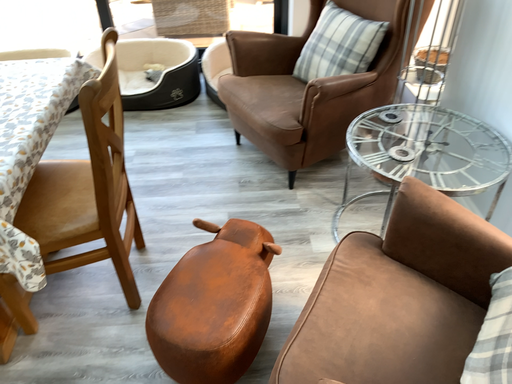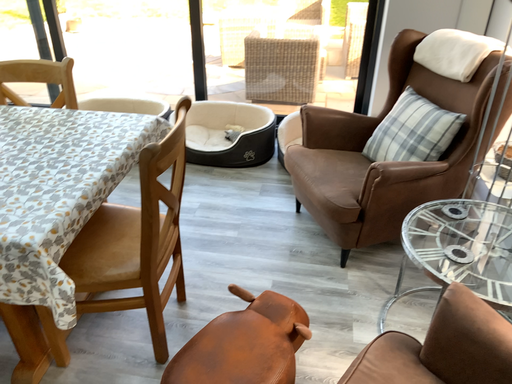
Question: How did the camera likely rotate when shooting the video?

Choices:
 (A) rotated left
 (B) rotated right

Answer: (A)